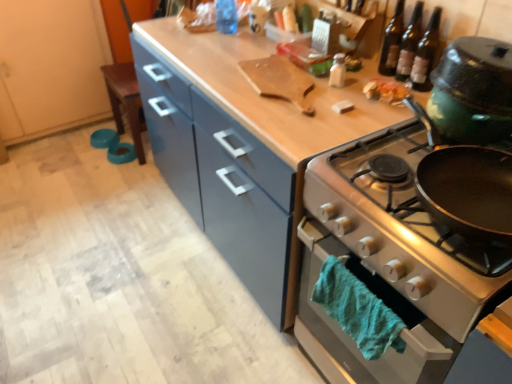
This screenshot has width=512, height=384. I want to click on free location above wooden cutting board at upper center (from a real-world perspective), so click(271, 77).